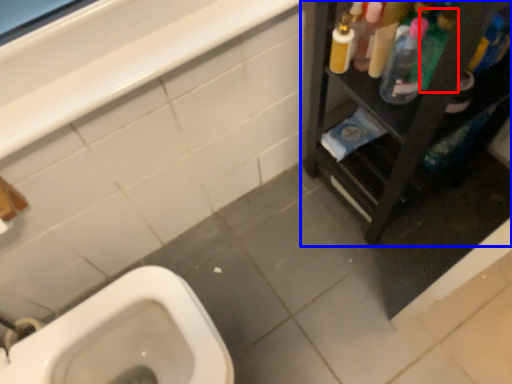
Question: Which point is further to the camera, cleaning product (highlighted by a red box) or furniture (highlighted by a blue box)?

Choices:
 (A) cleaning product
 (B) furniture

Answer: (A)